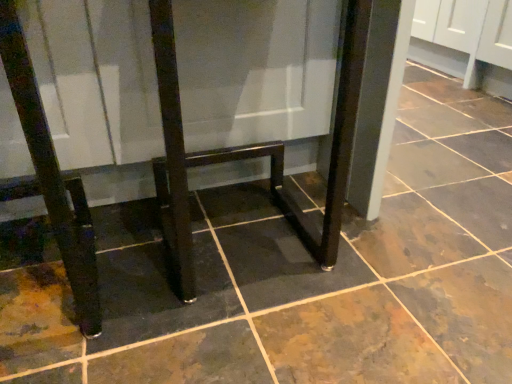
Where is `free space that is to the left of glossy dark wood table at center, which appears as the first furniture when viewed from the right`? free space that is to the left of glossy dark wood table at center, which appears as the first furniture when viewed from the right is located at coordinates (126, 243).